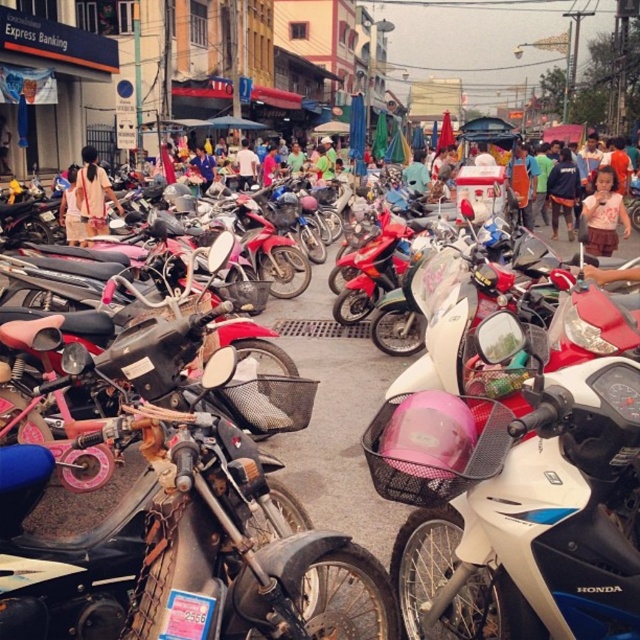
Looking at this image, you are a fashion designer observing the street scene. You notice the pink fabric dress at right and the dark blue shirt at center. Which clothing item has a shorter length?

The pink fabric dress at right is shorter than the dark blue shirt at center.

You are standing at the point marked by the coordinates point (x=204, y=557) in the image. What object are you standing on?

The point (x=204, y=557) corresponds to the rusty metal motorcycle at center, so you are standing on the rusty metal motorcycle at center.